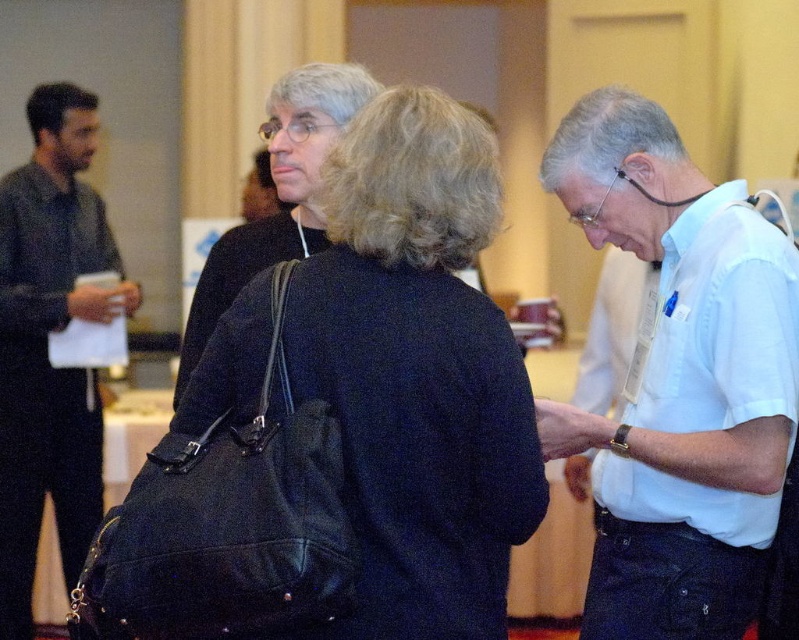
You are organizing a small event and need to know if the black leather bag at center can fit into a storage compartment that is the same width as the white cotton shirt at center. Based on the scene, can it fit?

The black leather bag at center is wider than the white cotton shirt at center, so it will not fit into the storage compartment with the same width as the white cotton shirt at center.

What is the exact position of the black leather bag at center in the image?

The black leather bag at center is located at point coordinates of (418, 372).